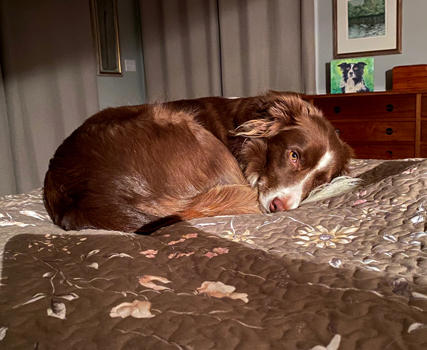
The width and height of the screenshot is (427, 350). I want to click on bed, so click(x=275, y=323).